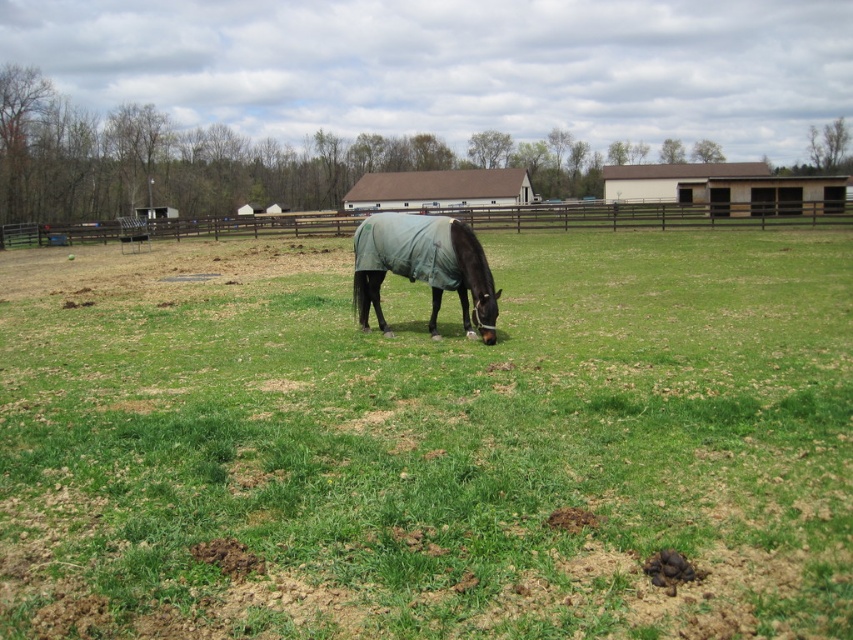
You are a farmer checking on your animals. You see the green matte horse at center and the dark green fabric horse at center in the field. Which horse should you approach first if you want to interact with the larger one?

You should approach the green matte horse at center first because it is bigger than the dark green fabric horse at center.

You are a farmer checking on your horses in the field. You see the green matte horse at center and the dark green fabric horse at center. Which horse is closer to you?

The green matte horse at center is closer to you since it is in front of the dark green fabric horse at center.

You are a farmer who needs to lead the green matte horse at center and the dark green fabric horse at center to a stable 5 meters away. Can you move them both to the stable without needing to push them closer together?

The distance between the green matte horse at center and the dark green fabric horse at center is 2.64 meters. Since the stable is 5 meters away, you can move them both to the stable without needing to push them closer together because the distance between them is already less than the 5 meters required to reach the stable.